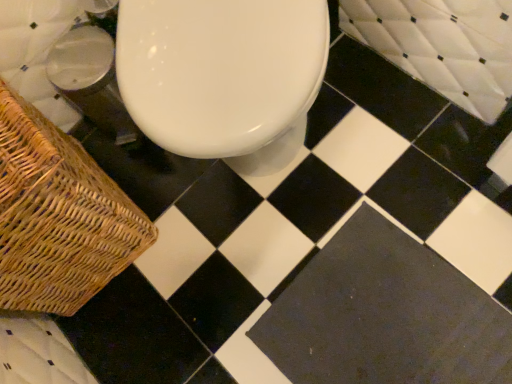
Question: From a real-world perspective, does white quilted bath at upper right stand above black matte tile at center?

Choices:
 (A) no
 (B) yes

Answer: (B)

Question: Can you confirm if white quilted bath at upper right is bigger than black matte tile at center?

Choices:
 (A) no
 (B) yes

Answer: (B)

Question: Can you confirm if white quilted bath at upper right is positioned to the right of black matte tile at center?

Choices:
 (A) no
 (B) yes

Answer: (B)

Question: Does white quilted bath at upper right have a lesser width compared to black matte tile at center?

Choices:
 (A) yes
 (B) no

Answer: (A)

Question: Would you say white quilted bath at upper right is outside black matte tile at center?

Choices:
 (A) no
 (B) yes

Answer: (B)

Question: Is white quilted bath at upper right inside the boundaries of woven brown picnic basket at lower left, or outside?

Choices:
 (A) inside
 (B) outside

Answer: (B)

Question: In terms of width, does white quilted bath at upper right look wider or thinner when compared to woven brown picnic basket at lower left?

Choices:
 (A) thin
 (B) wide

Answer: (A)

Question: Considering their positions, is white quilted bath at upper right located in front of or behind woven brown picnic basket at lower left?

Choices:
 (A) behind
 (B) front

Answer: (A)

Question: Is white quilted bath at upper right bigger or smaller than woven brown picnic basket at lower left?

Choices:
 (A) small
 (B) big

Answer: (A)

Question: Is woven brown picnic basket at lower left in front of or behind white quilted bath at upper right in the image?

Choices:
 (A) behind
 (B) front

Answer: (B)

Question: Looking at their shapes, would you say woven brown picnic basket at lower left is wider or thinner than white quilted bath at upper right?

Choices:
 (A) wide
 (B) thin

Answer: (A)

Question: Is woven brown picnic basket at lower left spatially inside white quilted bath at upper right, or outside of it?

Choices:
 (A) inside
 (B) outside

Answer: (B)

Question: Does point (120, 251) appear closer or farther from the camera than point (425, 64)?

Choices:
 (A) farther
 (B) closer

Answer: (B)

Question: Is black matte tile at center in front of or behind woven brown picnic basket at lower left in the image?

Choices:
 (A) front
 (B) behind

Answer: (B)

Question: From the image's perspective, is black matte tile at center positioned above or below woven brown picnic basket at lower left?

Choices:
 (A) below
 (B) above

Answer: (A)